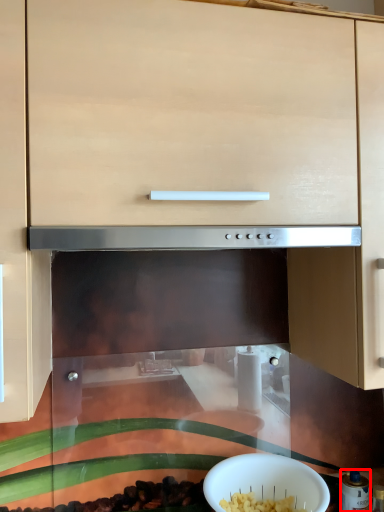
Question: From the image's perspective, what is the correct spatial relationship of appliance (annotated by the red box) in relation to bowl?

Choices:
 (A) below
 (B) above

Answer: (A)